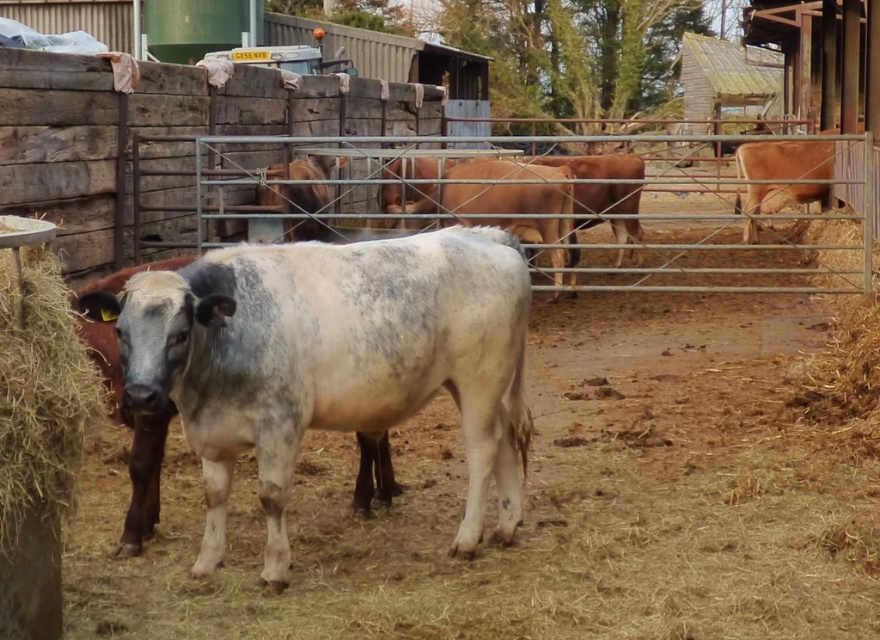
Does brown straw at left have a smaller size compared to brown matte cow at right?

Correct, brown straw at left occupies less space than brown matte cow at right.

Is the position of brown straw at left less distant than that of brown matte cow at right?

Yes, brown straw at left is in front of brown matte cow at right.

Who is more distant from viewer, [27,380] or [819,148]?

The point [819,148] is more distant.

The width and height of the screenshot is (880, 640). What are the coordinates of `brown straw at left` in the screenshot? It's located at (39, 392).

Does point (350, 397) come farther from viewer compared to point (1, 438)?

Yes.

Describe the element at coordinates (332, 360) in the screenshot. I see `speckled white cow at center` at that location.

Between point (274, 372) and point (72, 401), which one is positioned behind?

The point (274, 372) is more distant.

What are the coordinates of `speckled white cow at center` in the screenshot? It's located at (332, 360).

Who is taller, speckled white cow at center or brown matte cow at right?

brown matte cow at right

Between point (501, 483) and point (827, 192), which one is positioned in front?

Point (501, 483) is more forward.

I want to click on speckled white cow at center, so click(332, 360).